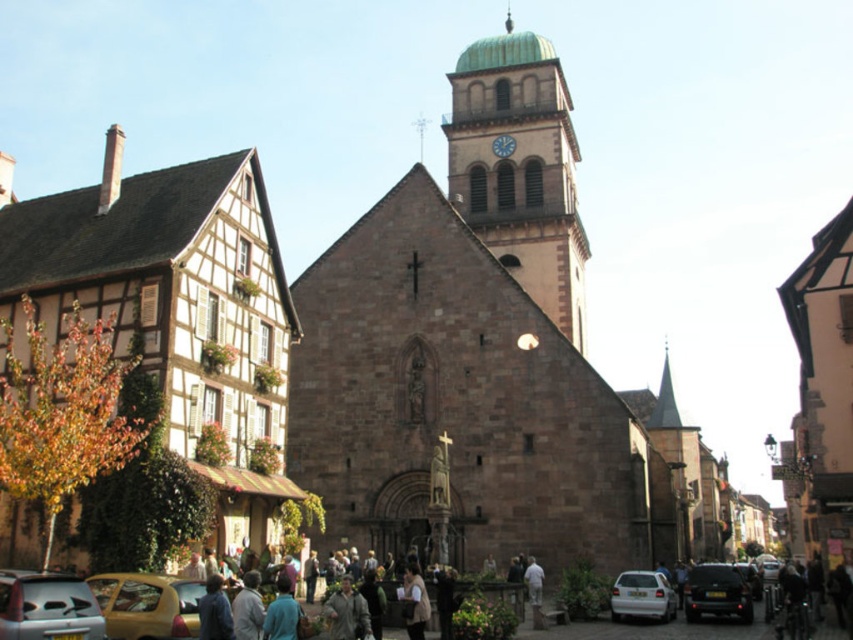
Can you confirm if shiny black car at lower right is thinner than gray wool coat at lower center?

No.

Between shiny black car at lower right and gray wool coat at lower center, which one appears on the right side from the viewer's perspective?

shiny black car at lower right is more to the right.

In order to click on shiny black car at lower right in this screenshot , I will do `click(717, 593)`.

This screenshot has height=640, width=853. What are the coordinates of `shiny black car at lower right` in the screenshot? It's located at (717, 593).

The image size is (853, 640). What do you see at coordinates (47, 605) in the screenshot?
I see `metallic silver car at lower left` at bounding box center [47, 605].

Which is in front, point (54, 611) or point (505, 138)?

Point (54, 611) is in front.

This screenshot has height=640, width=853. I want to click on metallic silver car at lower left, so pyautogui.click(x=47, y=605).

Can you confirm if wooden half-timbered house at left is positioned above white matte car at lower center?

Yes, wooden half-timbered house at left is above white matte car at lower center.

Which is below, wooden half-timbered house at left or white matte car at lower center?

Positioned lower is white matte car at lower center.

Between point (263, 504) and point (650, 598), which one is positioned behind?

Point (263, 504)

You are a GUI agent. You are given a task and a screenshot of the screen. Output one action in this format:
    pyautogui.click(x=<x>, y=<y>)
    Task: Click on the wooden half-timbered house at left
    The width and height of the screenshot is (853, 640).
    Given the screenshot: What is the action you would take?
    pyautogui.click(x=172, y=304)